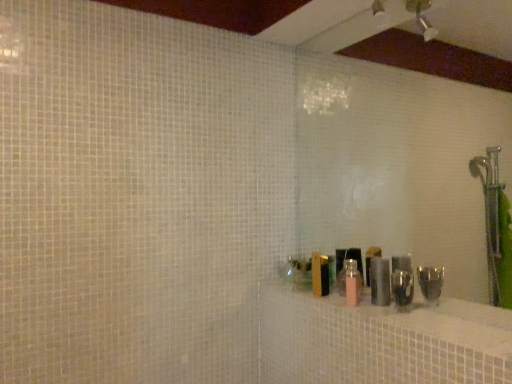
Question: Considering their positions, is pink matte bottle at center located in front of or behind pink matte bottle at center, the 2th toiletry from the right?

Choices:
 (A) behind
 (B) front

Answer: (B)

Question: From a real-world perspective, is pink matte bottle at center above or below pink matte bottle at center, the 2th toiletry from the right?

Choices:
 (A) below
 (B) above

Answer: (A)

Question: Based on their relative distances, which object is farther from the pink matte bottle at center, the 2th toiletry from the right?

Choices:
 (A) metallic silver canister at right, the 2th toiletry when ordered from left to right
 (B) pink matte bottle at center

Answer: (B)

Question: Which object is the closest to the pink matte bottle at center?

Choices:
 (A) pink matte bottle at center, which is the 1th toiletry from left to right
 (B) metallic silver canister at right, which is the first toiletry from right to left

Answer: (B)